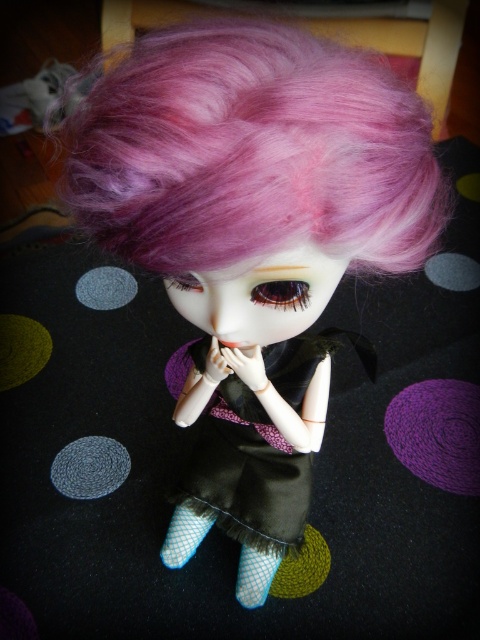
Question: Is pink fluffy wig at center bigger than brown glossy eye at center?

Choices:
 (A) yes
 (B) no

Answer: (A)

Question: Which point is closer to the camera?

Choices:
 (A) satin-like purple eye at center
 (B) brown glossy eye at center

Answer: (B)

Question: Which point is farther to the camera?

Choices:
 (A) (187, 285)
 (B) (289, 285)
 (C) (385, 236)
 (D) (280, 362)

Answer: (D)

Question: Does purple satin dress at center have a larger size compared to brown glossy eye at center?

Choices:
 (A) yes
 (B) no

Answer: (A)

Question: Where is purple satin dress at center located in relation to brown glossy eye at center in the image?

Choices:
 (A) left
 (B) right

Answer: (A)

Question: Which of the following is the farthest from the observer?

Choices:
 (A) (269, 294)
 (B) (183, 275)

Answer: (A)